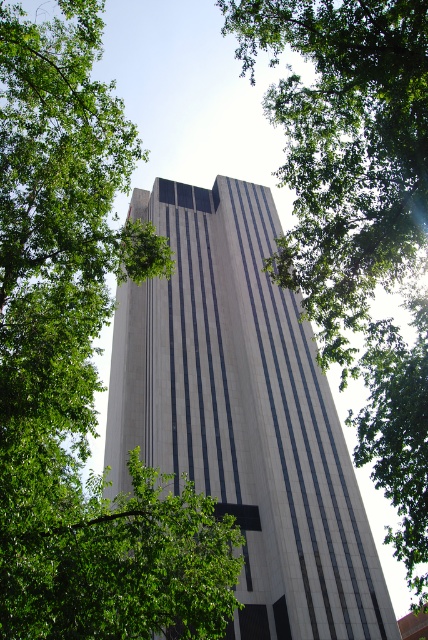
Question: Which point is farther to the camera?

Choices:
 (A) green leafy tree at upper left
 (B) white marble tower at center

Answer: (B)

Question: Which point is farther to the camera?

Choices:
 (A) (284, 376)
 (B) (48, 330)
 (C) (347, 154)

Answer: (A)

Question: Does green leafy tree at center have a larger size compared to white marble tower at center?

Choices:
 (A) yes
 (B) no

Answer: (A)

Question: Does white marble tower at center appear over green leafy tree at upper left?

Choices:
 (A) no
 (B) yes

Answer: (A)

Question: Estimate the real-world distances between objects in this image. Which object is farther from the white marble tower at center?

Choices:
 (A) green leafy tree at center
 (B) green leafy tree at upper left

Answer: (A)

Question: Can you confirm if white marble tower at center is positioned below green leafy tree at upper left?

Choices:
 (A) yes
 (B) no

Answer: (A)